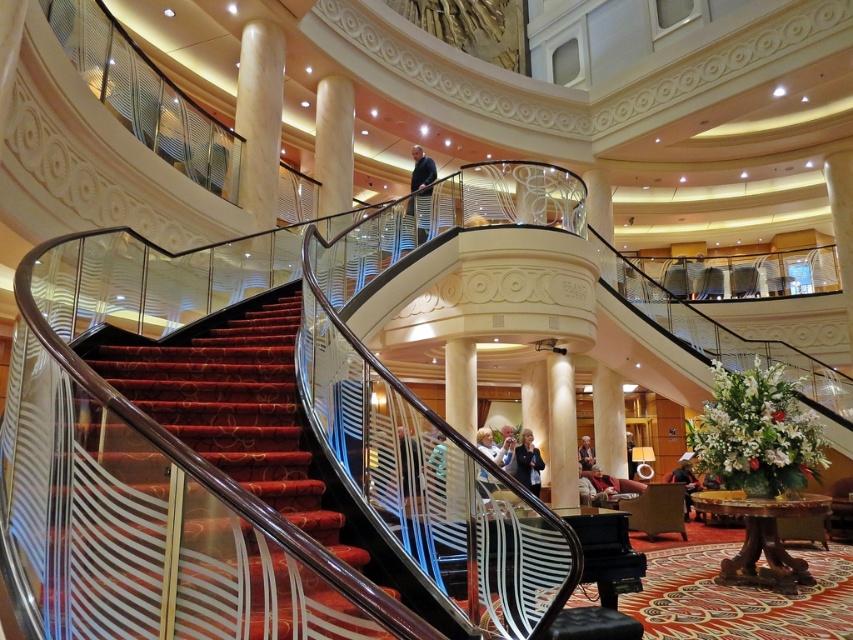
You are an interior designer assessing the grand building. You need to decide if the velvet red stairs at center can be seen from the base of the creamy marble column at upper center. Based on their heights, what do you conclude?

The velvet red stairs at center has a lesser height compared to creamy marble column at upper center, so the stairs are shorter and likely visible from the column base.